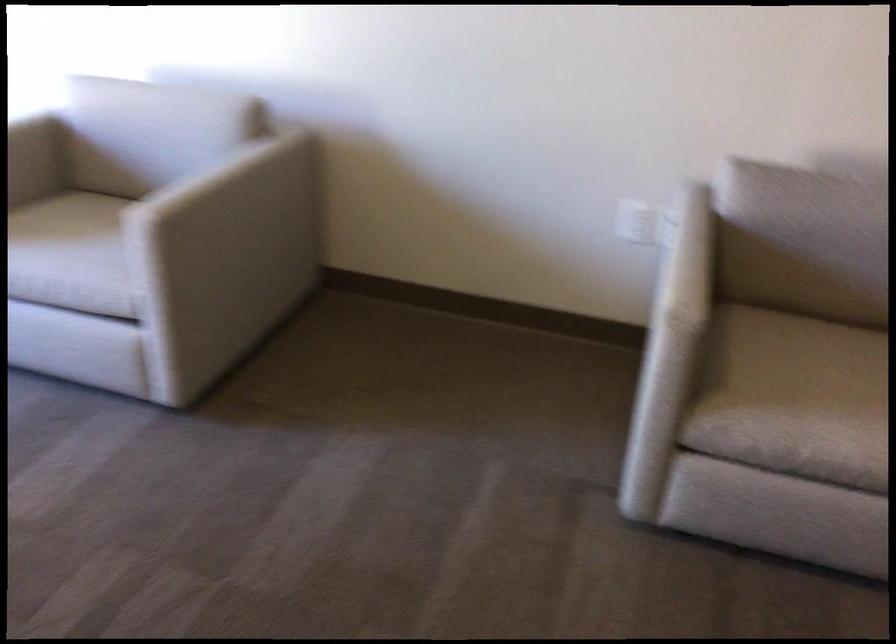
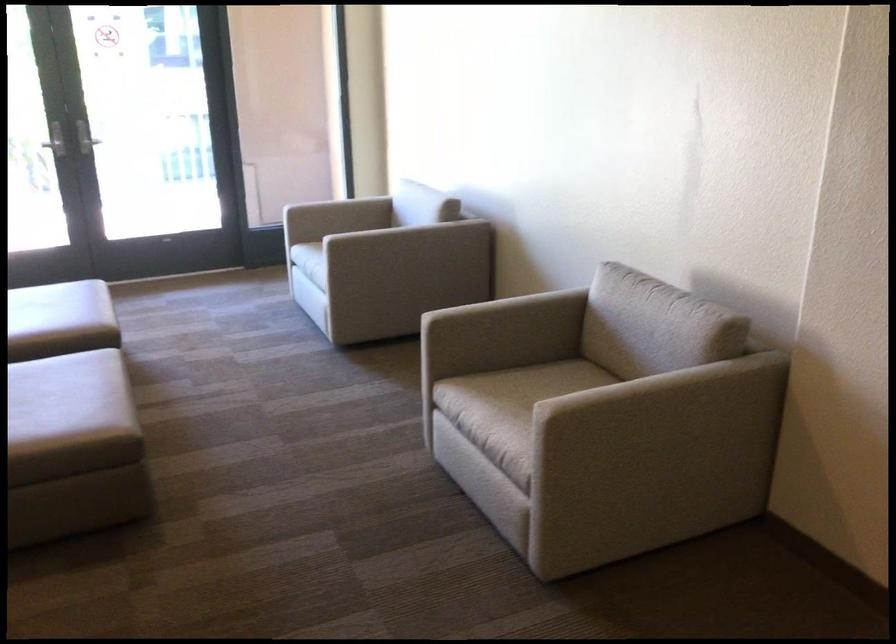
In the second image, find the point that corresponds to (x=179, y=229) in the first image.

(316, 240)